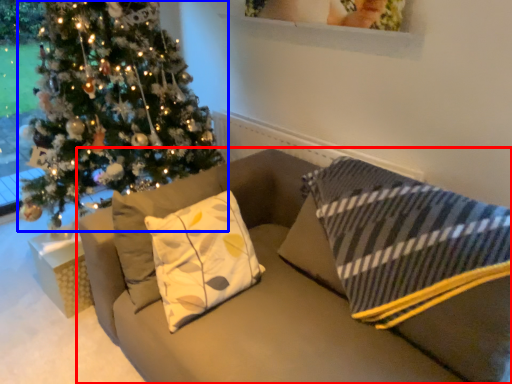
Question: Which object is further to the camera taking this photo, studio couch (highlighted by a red box) or christmas tree (highlighted by a blue box)?

Choices:
 (A) studio couch
 (B) christmas tree

Answer: (B)